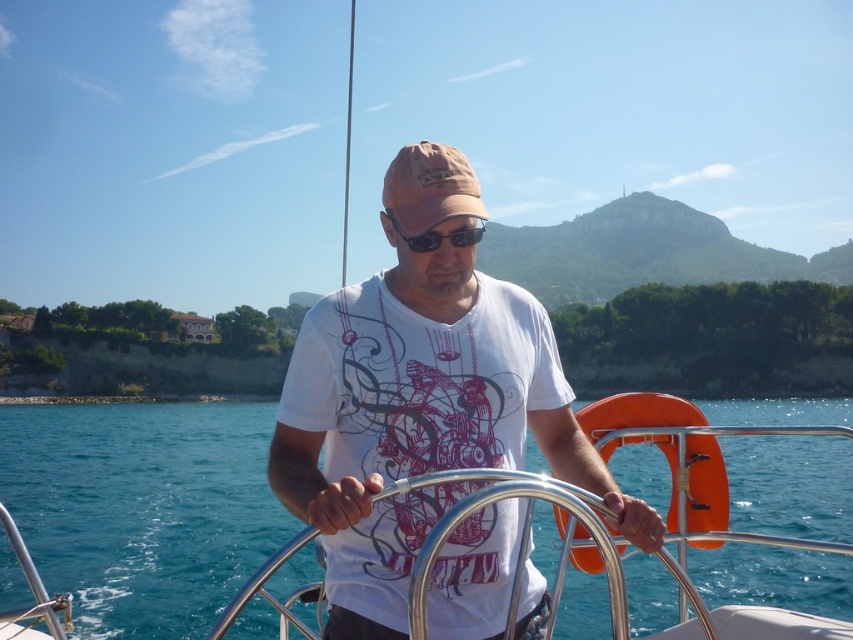
Question: Which object is farther from the camera taking this photo?

Choices:
 (A) clear blue water at center
 (B) white matte t-shirt at center
 (C) tan fabric baseball cap at center
 (D) black plastic goggles at center

Answer: (D)

Question: Is white matte t-shirt at center to the left of tan fabric baseball cap at center from the viewer's perspective?

Choices:
 (A) yes
 (B) no

Answer: (A)

Question: Observing the image, what is the correct spatial positioning of clear blue water at center in reference to white matte t-shirt at center?

Choices:
 (A) above
 (B) below

Answer: (B)

Question: Where is tan fabric baseball cap at center located in relation to black plastic goggles at center in the image?

Choices:
 (A) left
 (B) right

Answer: (A)

Question: Which object appears farthest from the camera in this image?

Choices:
 (A) black plastic goggles at center
 (B) tan fabric baseball cap at center
 (C) clear blue water at center
 (D) white matte t-shirt at center

Answer: (A)

Question: Which of the following is the closest to the observer?

Choices:
 (A) black plastic goggles at center
 (B) tan fabric baseball cap at center
 (C) clear blue water at center

Answer: (C)